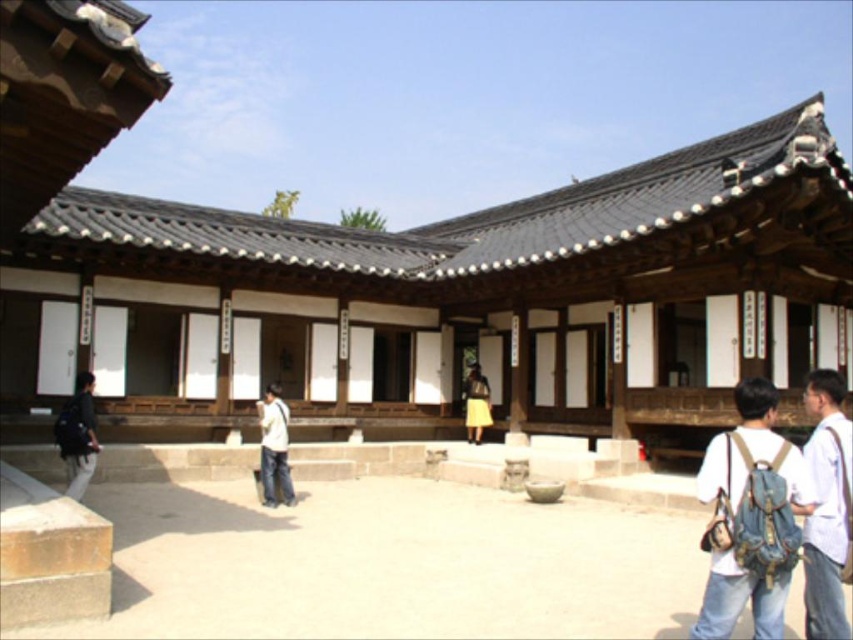
Question: Does denim backpack at lower right appear over denim jeans at center?

Choices:
 (A) no
 (B) yes

Answer: (B)

Question: Considering the relative positions of denim backpack at lower right and denim jeans at center in the image provided, where is denim backpack at lower right located with respect to denim jeans at center?

Choices:
 (A) below
 (B) above

Answer: (B)

Question: Which point is closer to the camera taking this photo?

Choices:
 (A) (264, 486)
 (B) (815, 438)
 (C) (720, 518)
 (D) (80, 419)

Answer: (C)

Question: Among these objects, which one is farthest from the camera?

Choices:
 (A) denim jeans at center
 (B) denim backpack at lower right
 (C) dark gray backpack at lower left

Answer: (A)

Question: Does white cotton shirt at lower right have a smaller size compared to dark gray backpack at lower left?

Choices:
 (A) yes
 (B) no

Answer: (A)

Question: Which object is the closest to the denim backpack at lower right?

Choices:
 (A) white cotton shirt at lower right
 (B) denim jeans at center
 (C) dark gray backpack at lower left

Answer: (A)